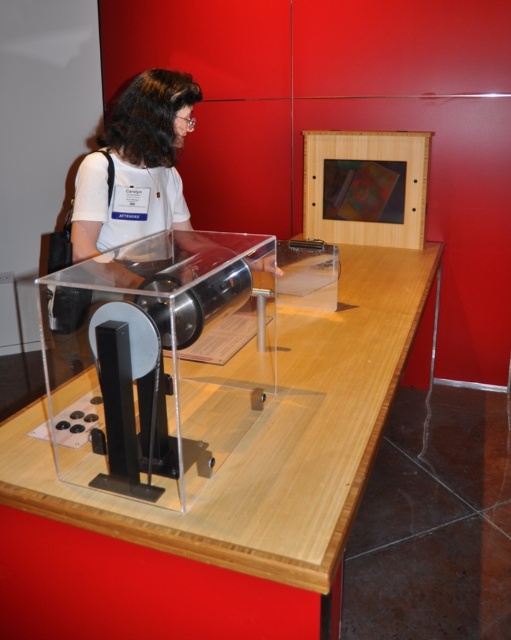
You are a visitor at the museum and want to take a photo of the mechanical device on the wooden table at center. However, there is a person with a matte white shirt at center blocking your view. Based on their positions, can you move to the left or right side to get an unobstructed view?

The wooden table at center is located below the matte white shirt at center. Therefore, moving to the right side might allow you to see around the person, as they are positioned centrally and blocking the direct view from the front. Alternatively, moving slightly behind them could also work if space permits.

Looking at this image, you are standing in front of the museum exhibit and want to take a photo. The exhibit has two points marked for alignment. The first point is at coordinates point (315, 317) and the second is at point (119, 179). Which point should you focus on first to ensure proper depth of field?

You should focus on point (315, 317) first because it is further away from the camera compared to point (119, 179), ensuring the depth of field captures both points effectively.